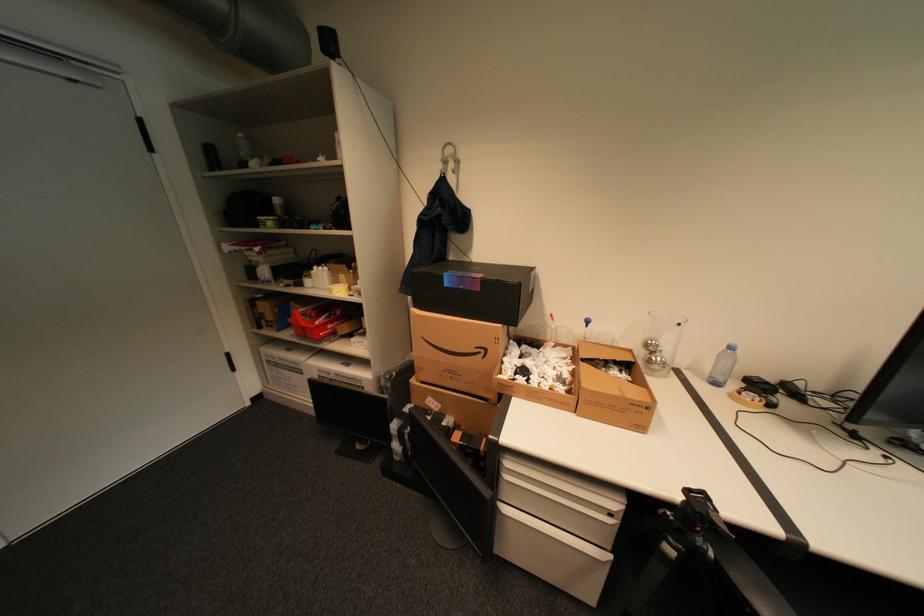
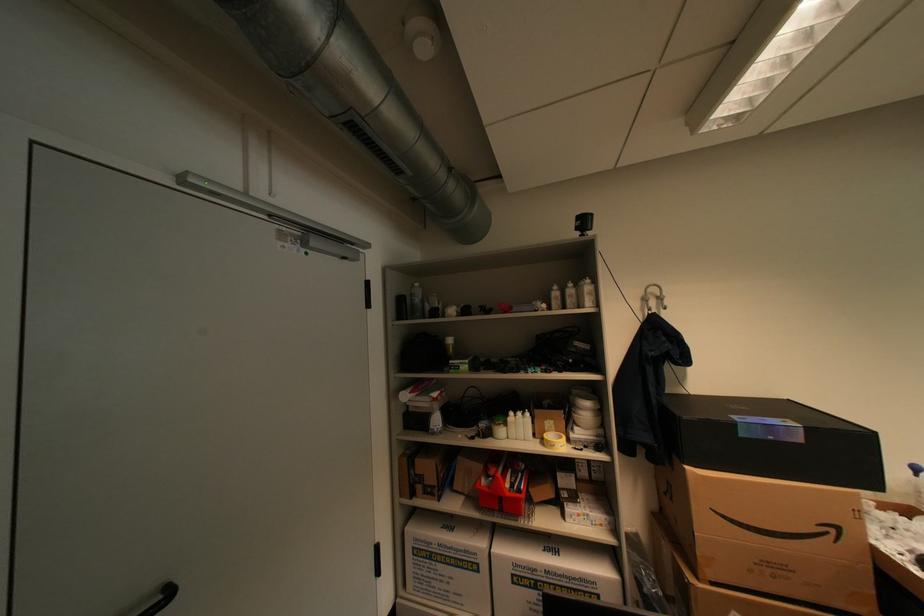
Where in the second image is the point corresponding to point 485,289 from the first image?

(808, 440)